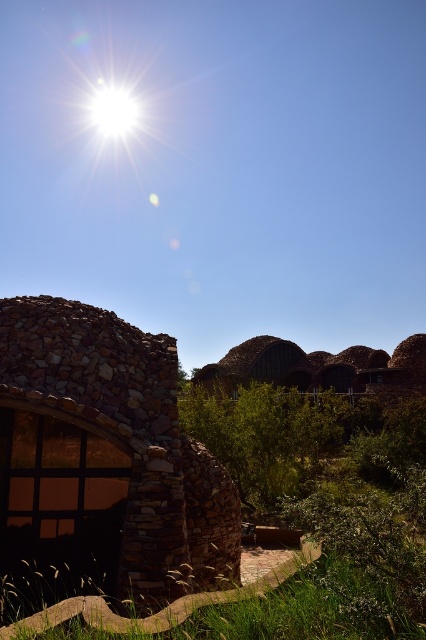
Question: Among these objects, which one is nearest to the camera?

Choices:
 (A) rustic stone hut at center
 (B) rustic stone hut at left

Answer: (B)

Question: Can you confirm if rustic stone hut at left is bigger than rustic stone hut at center?

Choices:
 (A) yes
 (B) no

Answer: (B)

Question: Which point appears closest to the camera in this image?

Choices:
 (A) (408, 348)
 (B) (51, 419)
 (C) (230, 596)

Answer: (C)

Question: Does rustic stone hut at left have a smaller size compared to rustic stone hut at center?

Choices:
 (A) no
 (B) yes

Answer: (B)

Question: Does rustic stone hut at center have a larger size compared to green grass at lower center?

Choices:
 (A) yes
 (B) no

Answer: (A)

Question: Which object appears closest to the camera in this image?

Choices:
 (A) rustic stone hut at left
 (B) green grass at lower center
 (C) rustic stone hut at center

Answer: (B)